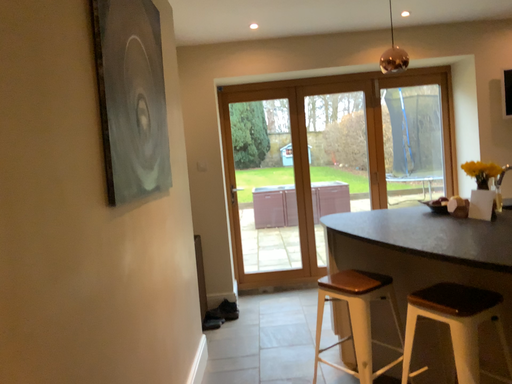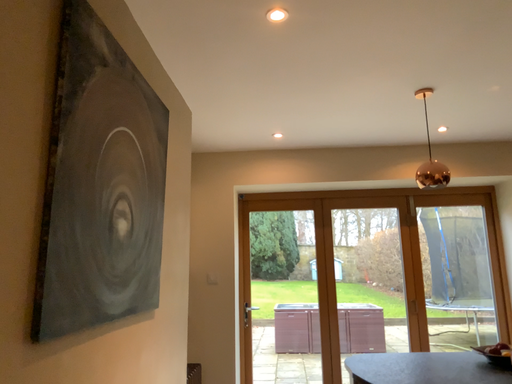
Question: How did the camera likely rotate when shooting the video?

Choices:
 (A) rotated upward
 (B) rotated downward

Answer: (A)